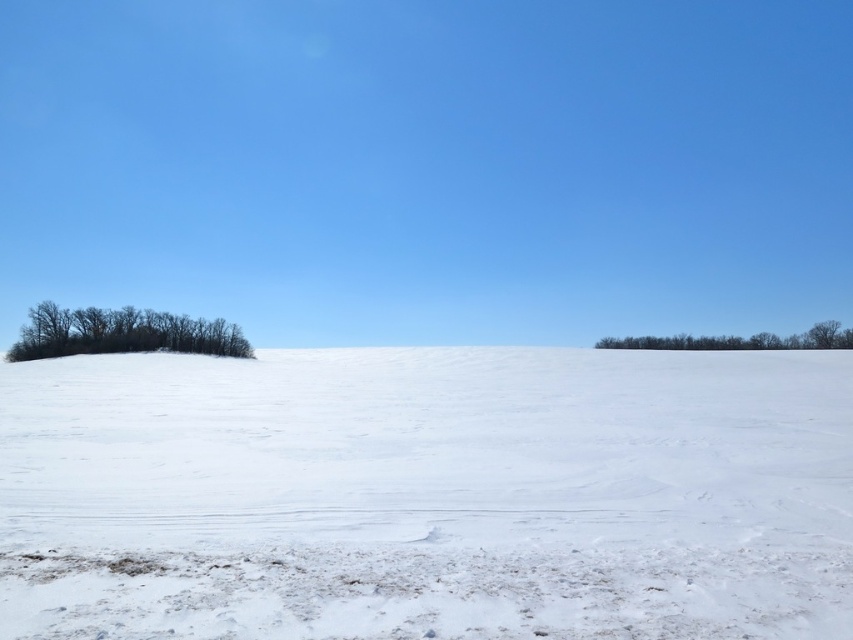
Question: Can you confirm if white powdery snow at center is thinner than green leafy trees at right?

Choices:
 (A) yes
 (B) no

Answer: (B)

Question: Which point is closer to the camera taking this photo?

Choices:
 (A) (318, 508)
 (B) (228, 326)
 (C) (753, 348)

Answer: (A)

Question: Which point is closer to the camera?

Choices:
 (A) (676, 340)
 (B) (723, 484)

Answer: (B)

Question: Is white powdery snow at center closer to the viewer compared to green leafy trees at right?

Choices:
 (A) yes
 (B) no

Answer: (A)

Question: Can you confirm if white powdery snow at center is wider than green leafy trees at right?

Choices:
 (A) no
 (B) yes

Answer: (B)

Question: Which of these objects is positioned farthest from the bare branches at left?

Choices:
 (A) white powdery snow at center
 (B) green leafy trees at right

Answer: (B)